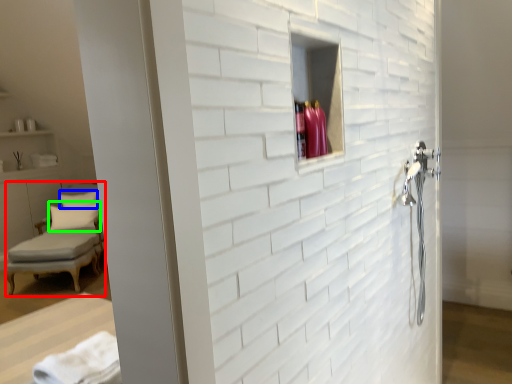
Question: Which object is the farthest from chair (highlighted by a red box)? Choose among these: pillow (highlighted by a blue box) or pillow (highlighted by a green box).

Choices:
 (A) pillow
 (B) pillow

Answer: (A)